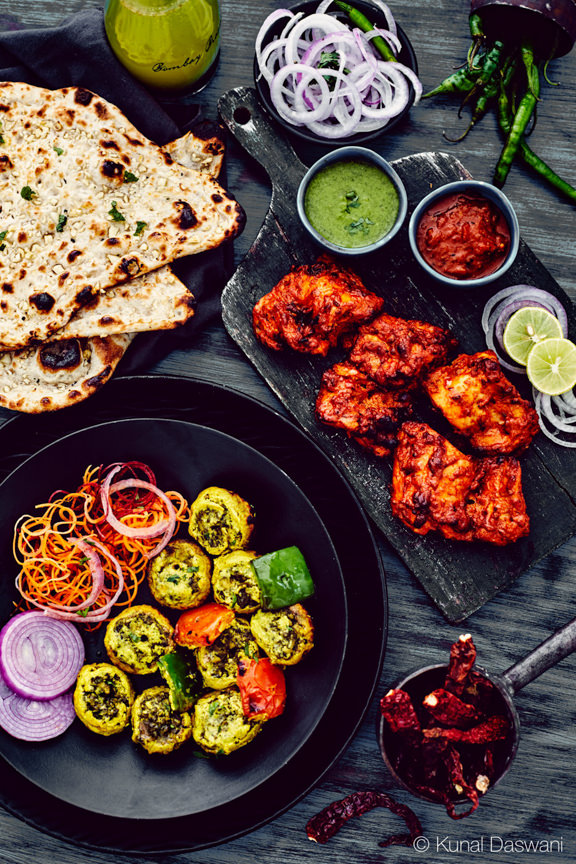
Locate an element on the screen. The height and width of the screenshot is (864, 576). plates is located at coordinates (295, 505), (374, 594).